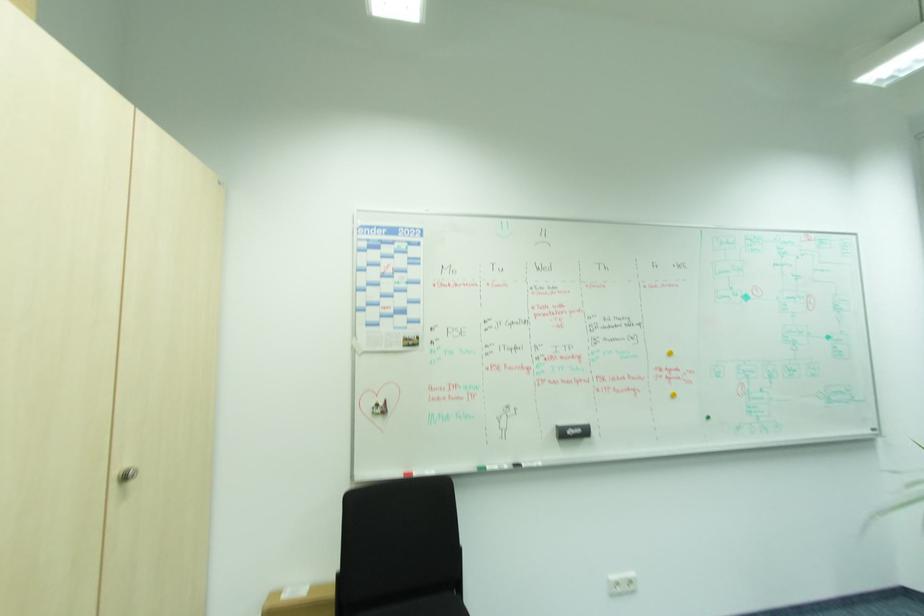
Where would you lift the black whiteboard eraser? Please return your answer as a coordinate pair (x, y).

(573, 431)